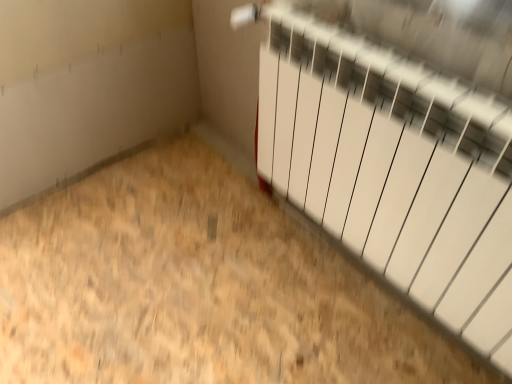
You are a GUI agent. You are given a task and a screenshot of the screen. Output one action in this format:
    pyautogui.click(x=<x>, y=<y>)
    Task: Click on the vacant region below white matte radiator at right (from a real-world perspective)
    This screenshot has height=384, width=512.
    Given the screenshot: What is the action you would take?
    pyautogui.click(x=353, y=272)